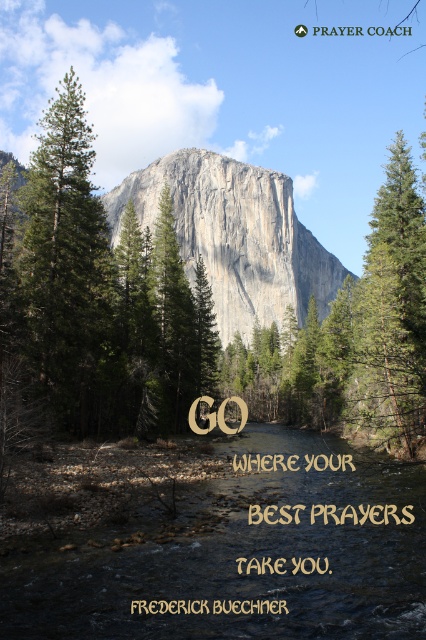
Can you confirm if clear water at center is positioned below gray rock mountain at center?

Yes, clear water at center is below gray rock mountain at center.

Is point (221, 472) less distant than point (198, 234)?

That is True.

Does point (255, 492) lie in front of point (123, 182)?

Yes, point (255, 492) is closer to viewer.

Identify the location of clear water at center. The width and height of the screenshot is (426, 640). (233, 552).

Between green textured pine tree at left and gray rock mountain at center, which one has more height?

With more height is green textured pine tree at left.

Can you confirm if green textured pine tree at left is positioned below gray rock mountain at center?

No, green textured pine tree at left is not below gray rock mountain at center.

Does point (120, 353) come closer to viewer compared to point (112, 216)?

Yes, it is.

Identify the location of green textured pine tree at left. Image resolution: width=426 pixels, height=640 pixels. (69, 273).

The height and width of the screenshot is (640, 426). What are the coordinates of `clear water at center` in the screenshot? It's located at (233, 552).

Who is lower down, clear water at center or green textured pine tree at left?

clear water at center

Describe the element at coordinates (233, 552) in the screenshot. I see `clear water at center` at that location.

Where is `clear water at center`? clear water at center is located at coordinates (233, 552).